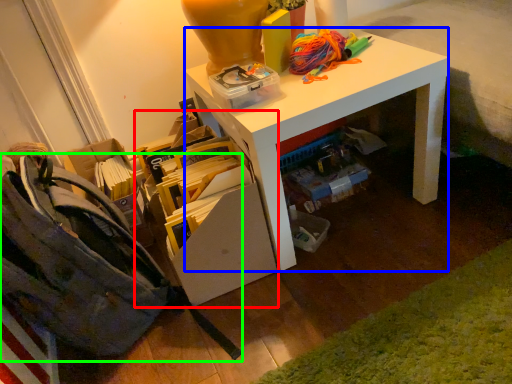
Question: Which object is positioned closest to shelf (highlighted by a red box)? Select from desk (highlighted by a blue box) and shoulder bag (highlighted by a green box).

Choices:
 (A) desk
 (B) shoulder bag

Answer: (A)